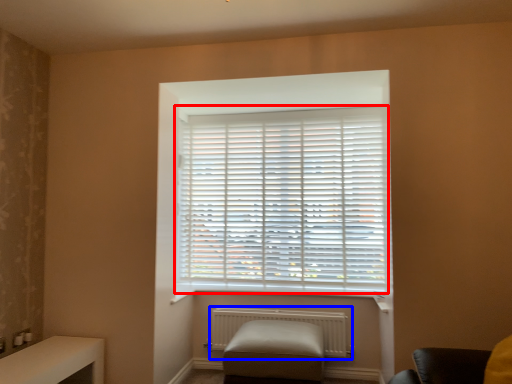
Question: Which of the following is the farthest to the observer, window blind (highlighted by a red box) or radiator (highlighted by a blue box)?

Choices:
 (A) window blind
 (B) radiator

Answer: (A)